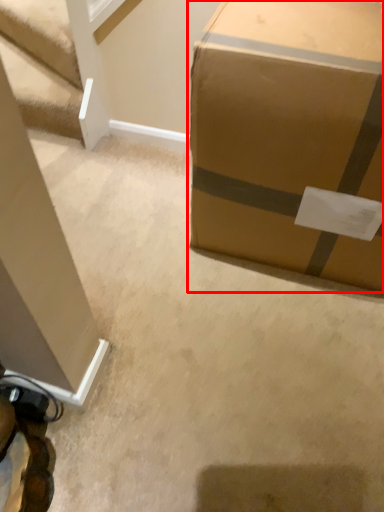
Question: From the image's perspective, what is the correct spatial positioning of box (annotated by the red box) in reference to stairwell?

Choices:
 (A) above
 (B) below

Answer: (B)